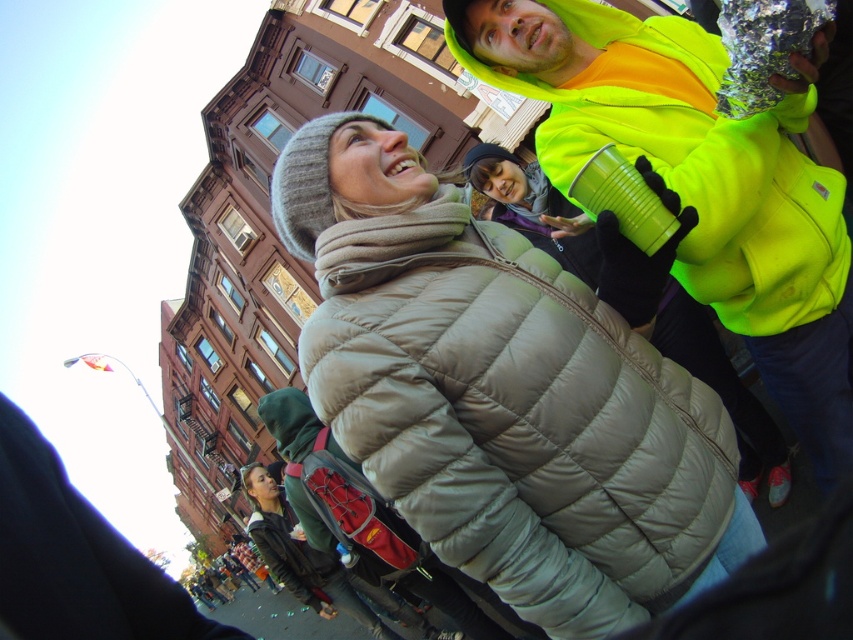
Question: Observing the image, what is the correct spatial positioning of neon yellow fleece at upper right in reference to dark green quilted jacket at lower left?

Choices:
 (A) left
 (B) right

Answer: (B)

Question: Where is matte gray puffer jacket at center located in relation to dark green quilted jacket at lower left in the image?

Choices:
 (A) left
 (B) right

Answer: (B)

Question: Which object is farther from the camera taking this photo?

Choices:
 (A) dark green quilted jacket at lower left
 (B) neon yellow fleece at upper right

Answer: (B)

Question: Is neon yellow fleece at upper right closer to camera compared to dark green quilted jacket at lower left?

Choices:
 (A) no
 (B) yes

Answer: (A)

Question: Which point is closer to the camera taking this photo?

Choices:
 (A) (595, 125)
 (B) (144, 632)

Answer: (B)

Question: Estimate the real-world distances between objects in this image. Which object is farther from the dark green quilted jacket at lower left?

Choices:
 (A) neon yellow fleece at upper right
 (B) matte gray puffer jacket at center

Answer: (A)